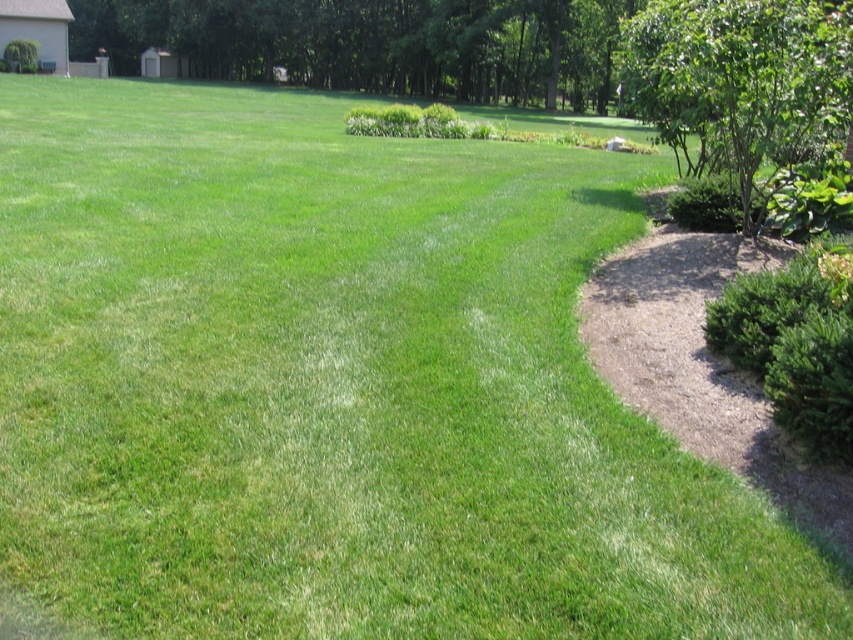
You are a gardener planning to water the green leafy bush at right and the green leafy bush at upper left. Based on their positions, which one is closer to the ground?

The green leafy bush at right is positioned under the green leafy bush at upper left, so it is closer to the ground.

You are standing on the grassy lawn and want to walk towards the green leafy tree at upper right and the green leafy bush at center. Which object will you reach first?

You will reach the green leafy tree at upper right first because it is closer to the viewer than the green leafy bush at center.

From the picture: You are planning to plant a new bush in the garden and want to ensure proper spacing. Considering the existing green leafy bush at right and green leafy bush at upper left, which one requires more vertical space due to its height?

The green leafy bush at upper left requires more vertical space because it is taller than the green leafy bush at right.